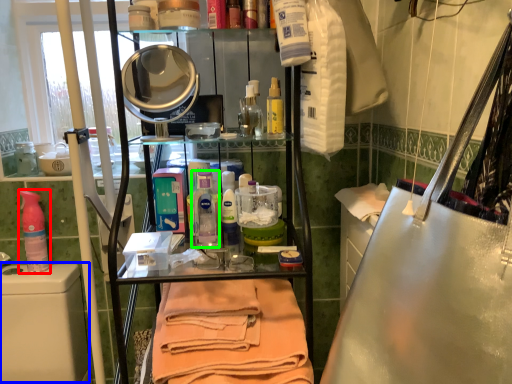
Question: Which object is positioned closest to cleaning product (highlighted by a red box)? Select from washing (highlighted by a blue box) and cleaning product (highlighted by a green box).

Choices:
 (A) washing
 (B) cleaning product

Answer: (A)